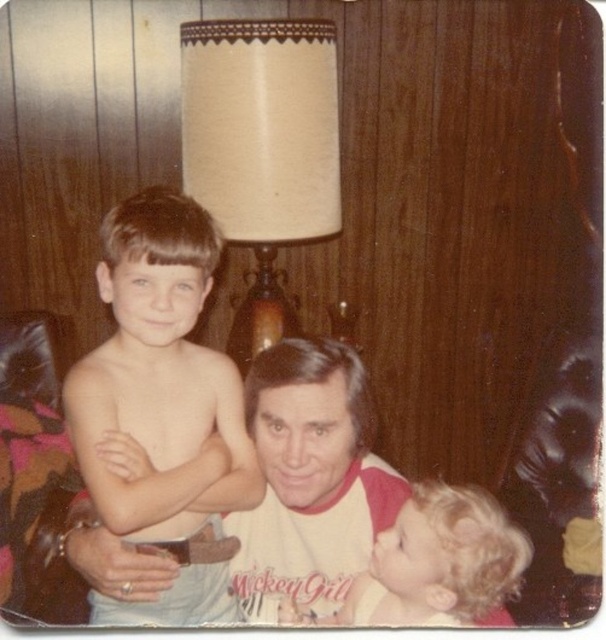
You are a photographer standing 5 feet away from the camera. You want to take a closeup shot of the shiny blonde hair at center. Can you reach it without moving the camera?

The shiny blonde hair at center is 3.47 feet from the camera. Since you are 5 feet away from the camera, you are 1.53 feet behind the camera. Therefore, you cannot reach the shiny blonde hair at center without moving the camera.

In the cozy living room scene, there is a beige fabric lampshade at upper center and curly blonde hair at lower right. From the perspective of someone standing in front of the scene, which object is positioned to the left?

The beige fabric lampshade at upper center is to the left of curly blonde hair at lower right.